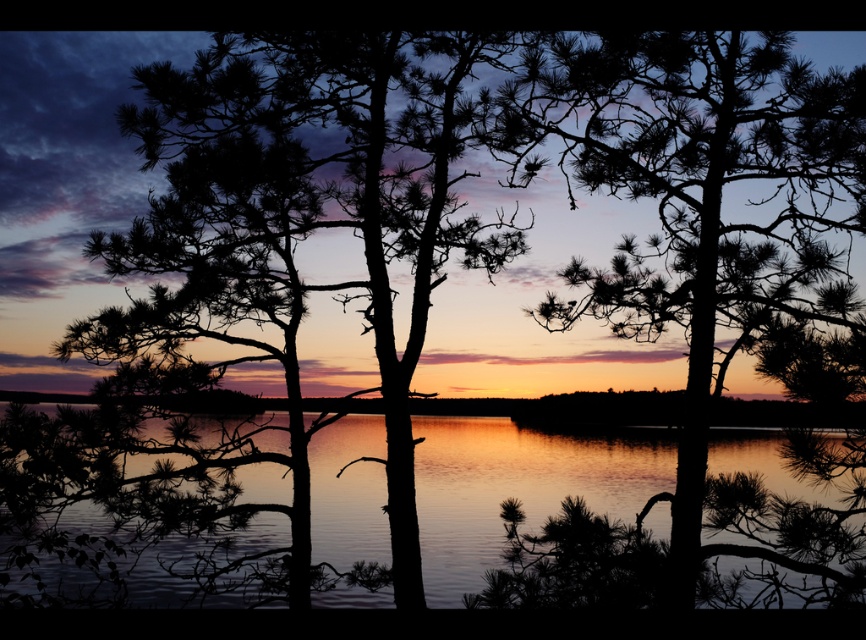
You are an artist planning to paint the sunset scene. You want to ensure the reflective water at center and the silhouette pine tree at center are proportionally accurate. Which object should you paint first if you want to start with the larger one?

The silhouette pine tree at center is larger than the reflective water at center, so you should paint the silhouette pine tree at center first.

From the picture: You are an artist trying to paint the sunset scene. You need to decide where to place the reflective water at center and the silhouette pine tree at center in your painting. According to the image, which object should be placed to the left of the other?

The reflective water at center should be placed to the left of the silhouette pine tree at center because the reflective water at center is positioned on the left side of silhouette pine tree at center.

You are standing at the edge of the water in the sunset scene. There is a point marked at coordinates [134,508]. According to the scene description, what would you find at that location?

At point [134,508] lies reflective water at center, which is part of the calm body of water reflecting the sunset colors.